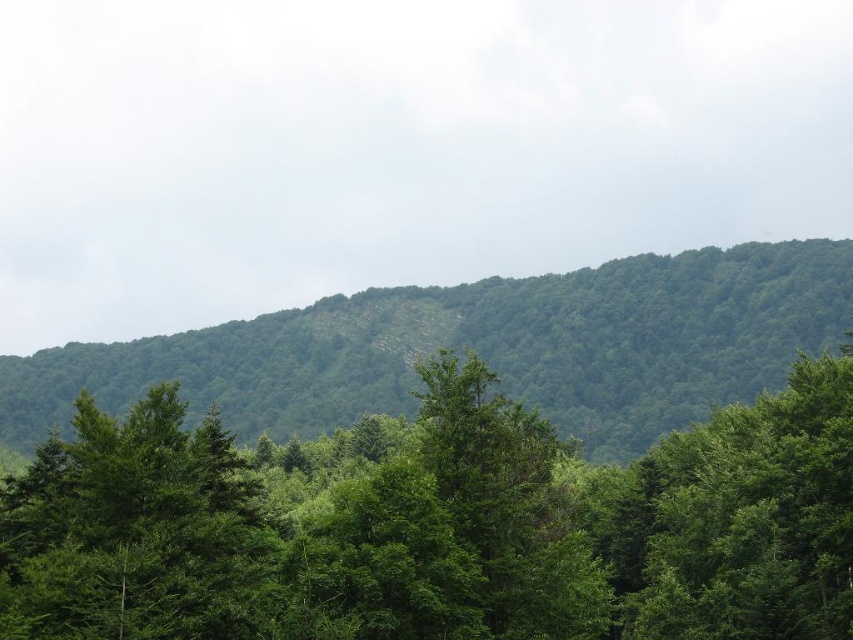
Question: Considering the relative positions of green leafy tree at center and green leafy forest at upper center in the image provided, where is green leafy tree at center located with respect to green leafy forest at upper center?

Choices:
 (A) left
 (B) right

Answer: (B)

Question: Is green leafy tree at center closer to the viewer compared to green leafy forest at upper center?

Choices:
 (A) no
 (B) yes

Answer: (B)

Question: Which object is farther from the camera taking this photo?

Choices:
 (A) green leafy forest at upper center
 (B) green leafy tree at center

Answer: (A)

Question: Which point is closer to the camera?

Choices:
 (A) (422, 572)
 (B) (775, 324)

Answer: (A)

Question: Which of the following is the farthest from the observer?

Choices:
 (A) green leafy tree at center
 (B) green leafy forest at upper center

Answer: (B)

Question: Is green leafy tree at center wider than green leafy forest at upper center?

Choices:
 (A) no
 (B) yes

Answer: (A)